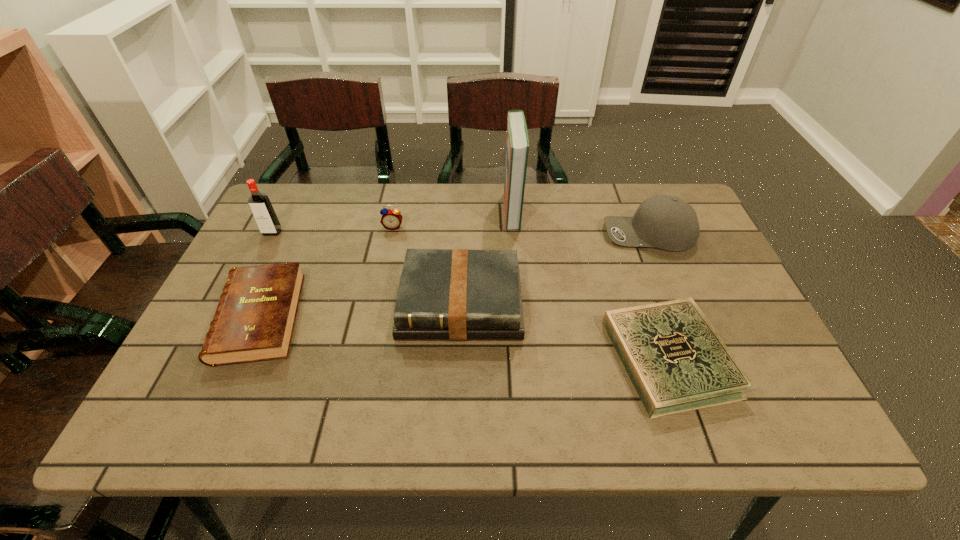
Find the location of a particular element. The height and width of the screenshot is (540, 960). free space located on the cover of the farthest hardback book is located at coordinates (477, 211).

The height and width of the screenshot is (540, 960). Identify the location of free space located on the cover of the farthest hardback book. (431, 211).

Image resolution: width=960 pixels, height=540 pixels. In order to click on vacant space located 0.330m on the cover of the farthest hardback book in this screenshot , I will do `click(395, 211)`.

This screenshot has width=960, height=540. Find the location of `free space located on the front and back of the vodka`. free space located on the front and back of the vodka is located at coordinates click(240, 297).

What are the coordinates of `vacant space located 0.160m on the front brim of the baseball cap` in the screenshot? It's located at (548, 234).

The width and height of the screenshot is (960, 540). Find the location of `free spot located 0.320m on the front brim of the baseball cap`. free spot located 0.320m on the front brim of the baseball cap is located at coordinates (492, 234).

What are the coordinates of `free point located 0.110m on the front brim of the baseball cap` in the screenshot? It's located at (565, 234).

The image size is (960, 540). I want to click on free location located 0.140m on the front-facing side of the alarm clock, so click(385, 265).

Locate an element on the screen. The image size is (960, 540). vacant position located 0.160m on the spine side of the third shortest hardback book is located at coordinates (456, 408).

Locate an element on the screen. This screenshot has width=960, height=540. blank space located on the back of the sixth tallest object is located at coordinates (306, 212).